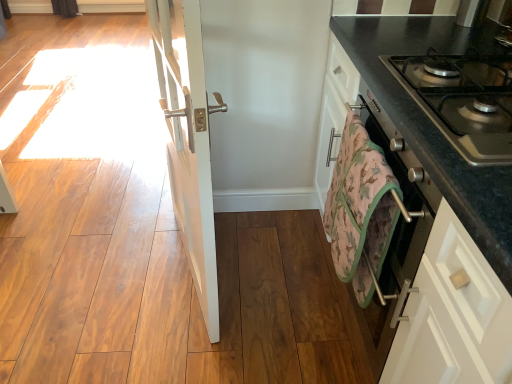
Question: Can you confirm if metallic gray gas stove at right is bigger than camouflage-patterned towel at lower right?

Choices:
 (A) yes
 (B) no

Answer: (A)

Question: Is metallic gray gas stove at right to the left of camouflage-patterned towel at lower right from the viewer's perspective?

Choices:
 (A) no
 (B) yes

Answer: (A)

Question: Is the position of metallic gray gas stove at right less distant than that of camouflage-patterned towel at lower right?

Choices:
 (A) no
 (B) yes

Answer: (B)

Question: Considering the relative sizes of metallic gray gas stove at right and camouflage-patterned towel at lower right in the image provided, is metallic gray gas stove at right taller than camouflage-patterned towel at lower right?

Choices:
 (A) no
 (B) yes

Answer: (A)

Question: Is metallic gray gas stove at right behind camouflage-patterned towel at lower right?

Choices:
 (A) no
 (B) yes

Answer: (A)

Question: In terms of height, does camouflage-patterned towel at lower right look taller or shorter compared to black granite countertop at right?

Choices:
 (A) tall
 (B) short

Answer: (B)

Question: From a real-world perspective, relative to black granite countertop at right, is camouflage-patterned towel at lower right vertically above or below?

Choices:
 (A) below
 (B) above

Answer: (B)

Question: Is camouflage-patterned towel at lower right spatially inside black granite countertop at right, or outside of it?

Choices:
 (A) outside
 (B) inside

Answer: (A)

Question: Considering their positions, is camouflage-patterned towel at lower right located in front of or behind black granite countertop at right?

Choices:
 (A) behind
 (B) front

Answer: (A)

Question: Would you say metallic gray gas stove at right is to the left or to the right of camouflage-patterned towel at lower right in the picture?

Choices:
 (A) left
 (B) right

Answer: (B)

Question: From a real-world perspective, is metallic gray gas stove at right physically located above or below camouflage-patterned towel at lower right?

Choices:
 (A) below
 (B) above

Answer: (B)

Question: In the image, is metallic gray gas stove at right positioned in front of or behind camouflage-patterned towel at lower right?

Choices:
 (A) front
 (B) behind

Answer: (A)

Question: Is metallic gray gas stove at right wider or thinner than camouflage-patterned towel at lower right?

Choices:
 (A) wide
 (B) thin

Answer: (A)

Question: Is metallic gray gas stove at right bigger or smaller than white glossy door at center?

Choices:
 (A) big
 (B) small

Answer: (B)

Question: From a real-world perspective, is metallic gray gas stove at right physically located above or below white glossy door at center?

Choices:
 (A) below
 (B) above

Answer: (B)